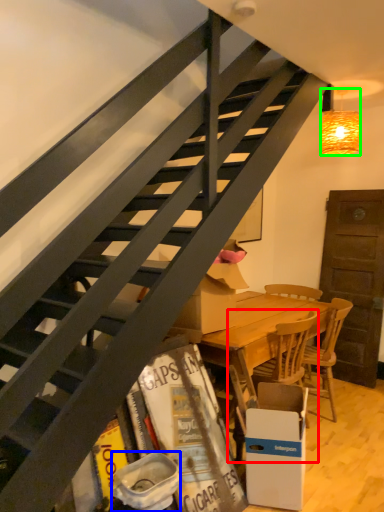
Question: Considering the real-world distances, which object is closest to chair (highlighted by a red box)? trash bin/can (highlighted by a blue box) or lamp (highlighted by a green box).

Choices:
 (A) trash bin/can
 (B) lamp

Answer: (A)